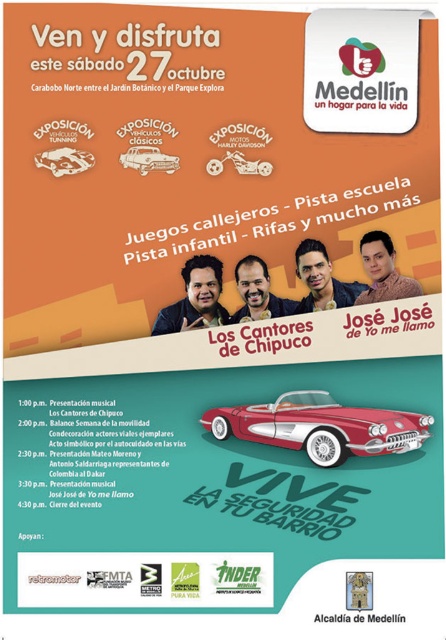
You are looking at a promotional poster for an event. There are two cars depicted in the upper section of the poster. The shiny metallic car at upper left and the shiny chrome car at center. From the perspective of someone viewing the poster, which car is positioned to the left of the other?

The shiny metallic car at upper left is positioned to the left of the shiny chrome car at center.

You are planning to attend the event and want to park your car. The venue has two parking spots available. One is near the shiny metallic car at upper left and the other is near the shiny chrome car at center. Which parking spot would allow you to park closer to the event entrance?

The shiny metallic car at upper left is larger than the shiny chrome car at center. Since larger vehicles typically require more space, the parking spot near the shiny chrome car at center might be closer to the entrance as it might be designed for smaller vehicles. However, without specific information about parking layout, it is uncertain. Please check the venue map for accurate directions.

In the scene shown: You are looking at the promotional poster for the event. There is a shiny red convertible at center and a shiny metallic car at upper left. Which car appears closer to you in the poster?

The shiny red convertible at center is closer to the viewer than the shiny metallic car at upper left.